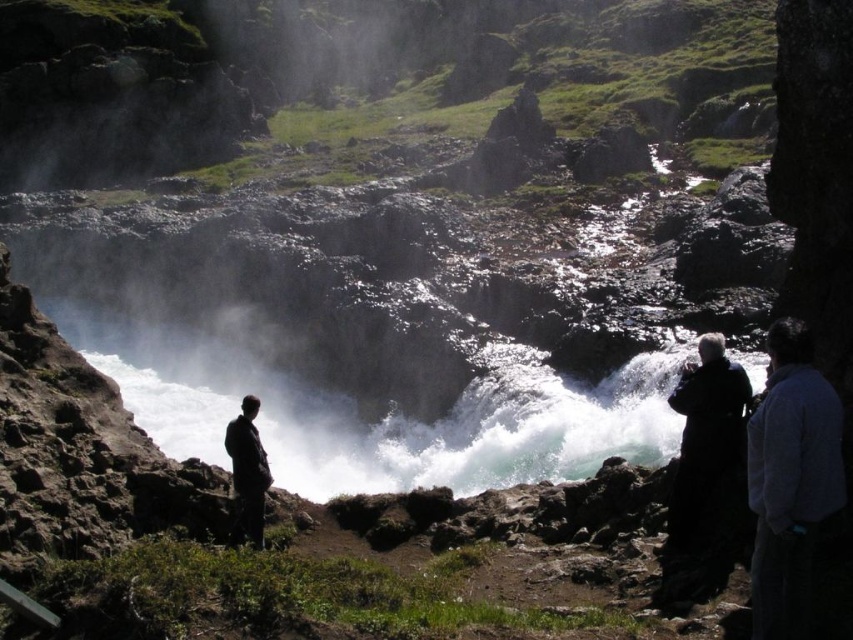
You are a hiker preparing to cross the rocky terrain near the waterfall. You see a dark blue fleece jacket at right and a dark gray suit at lower left. Which item is more likely to provide better traction on the wet, uneven rocks?

The dark blue fleece jacket at right is wider than the dark gray suit at lower left, but the question of traction relates to the clothing material and design rather than their physical dimensions. Neither the jacket nor the suit is designed for traction on wet rocks. Proper footwear like hiking boots would be more appropriate for safe footing.

You are a hiker who has misplaced your jacket and suit. You see the dark blue fleece jacket at right and the dark gray suit at lower left. Which item is located to the right of the other?

The dark blue fleece jacket at right is positioned on the right side of the dark gray suit at lower left.

Consider the image. You are a hiker who has just arrived at the waterfall. You notice two coats hanging on a nearby rock. Which one is positioned more to the left between the dark blue fleece jacket at right and the black matte coat at right?

The dark blue fleece jacket at right is positioned more to the left compared to the black matte coat at right.